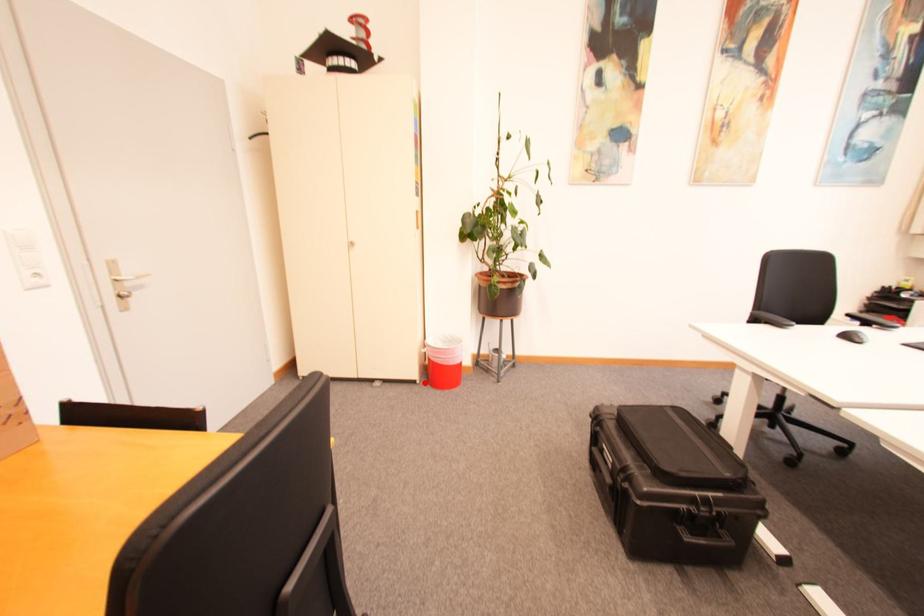
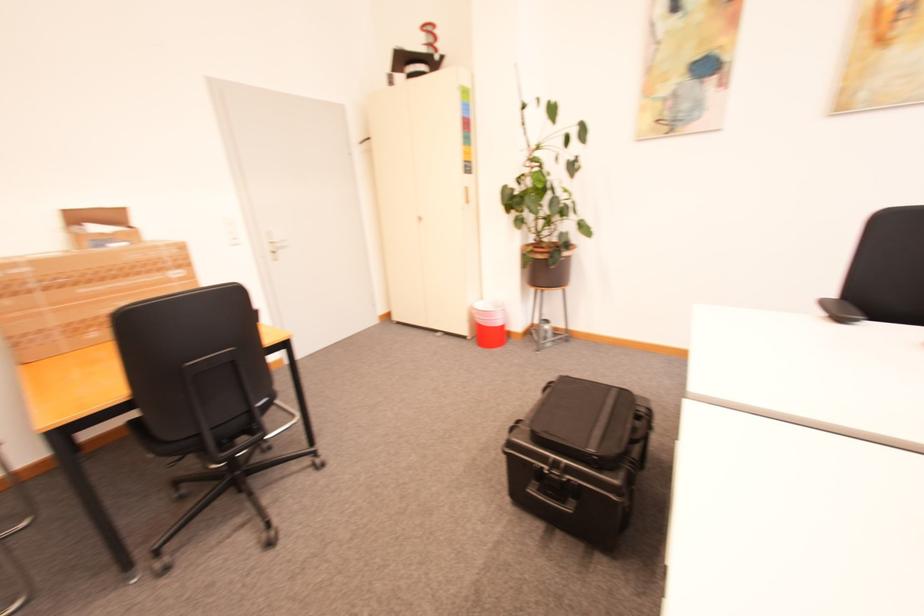
Question: I am providing you with two images of the same scene from different viewpoints. Given a red point in image1, look at the same physical point in image2. Is it:

Choices:
 (A) Closer to the viewpoint
 (B) Farther from the viewpoint

Answer: (A)